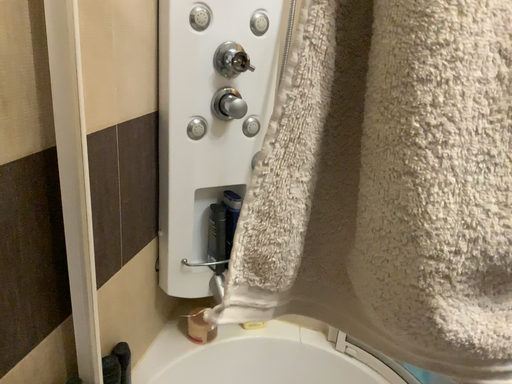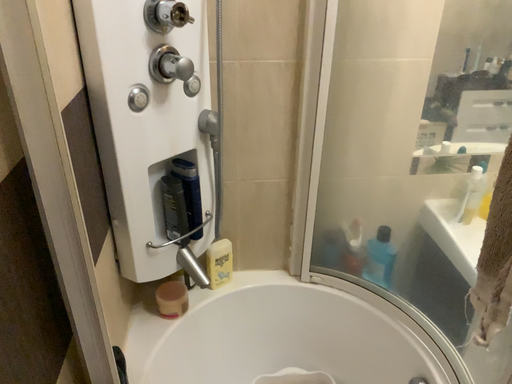
Question: How did the camera likely rotate when shooting the video?

Choices:
 (A) rotated left
 (B) rotated right

Answer: (B)